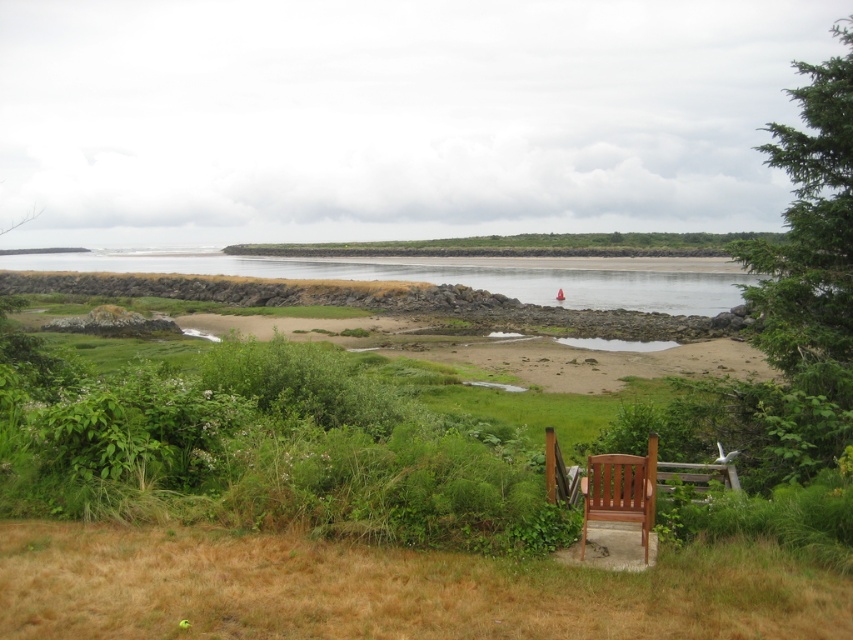
You are a hiker who wants to sit down and rest. You see the brown dry grass at lower center and the brown wood chair at center. Which one is shorter and safer to sit on?

The brown dry grass at lower center is shorter than the brown wood chair at center, so it is safer to sit on the brown dry grass at lower center.

You are standing on the beach and want to sit down. There is a brown wood chair at center and a wooden chair at lower center. Which chair is closer to the edge of the grassy area?

The wooden chair at lower center is closer to the edge of the grassy area because it is positioned at lower center, which is typically closer to the foreground and the edge compared to the brown wood chair at center.

You are standing at the edge of the grassy area near the wooden chair and want to take a photo of the coastal landscape. There are two points of interest marked in the image at coordinates point (32,556) and point (569,497). Which point should you focus on first if you want to capture the closest point to your current position?

Point (32,556) is closer to the camera than point (569,497), so you should focus on point (32,556) first as it is nearer to your current position.